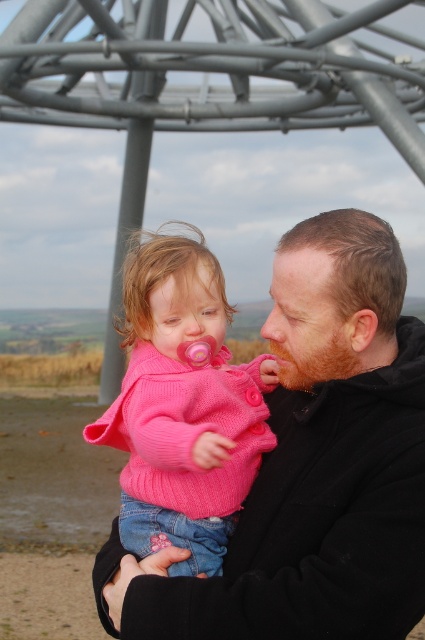
You are standing at the origin point in the image. You see two points, point (314, 228) and point (221, 305). Which point is closer to you?

Point (314, 228) is in front of point (221, 305), so it is closer to you.

You are a photographer trying to capture the child in the pink knitted sweater at center. The adult is wearing a black matte jacket at center. From your current position, can you see the child clearly without any obstruction?

The pink knitted sweater at center is behind the black matte jacket at center, so the adult wearing the black matte jacket at center is blocking the view of the child in the pink knitted sweater at center. You cannot see the child clearly from this angle.